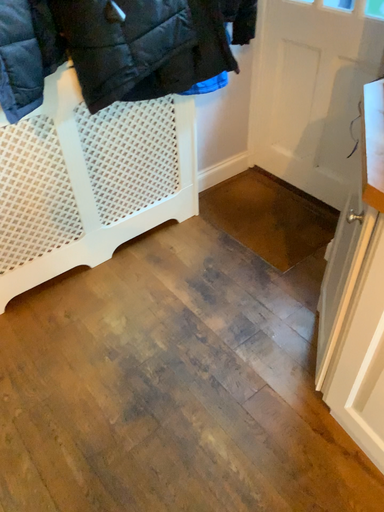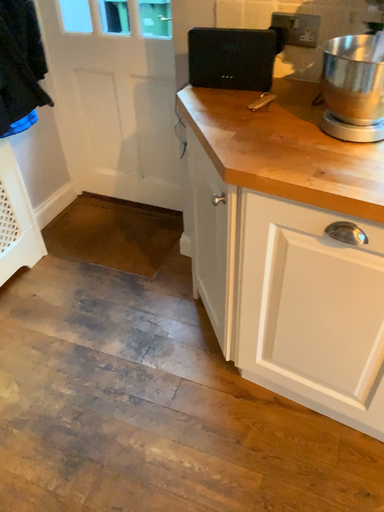
Question: How did the camera likely rotate when shooting the video?

Choices:
 (A) rotated left
 (B) rotated right

Answer: (B)